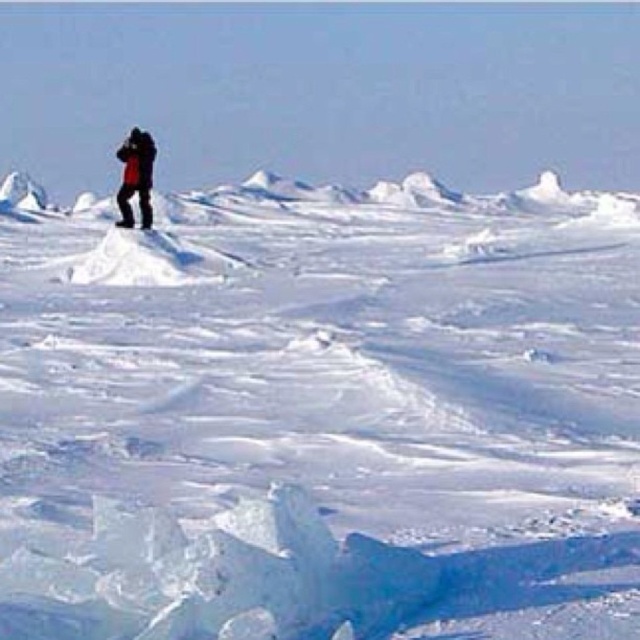
You are standing on the icy landscape and want to move towards the horizon. You see two points marked on your map, point (106, 456) and point (129, 216). Which point should you head towards if you want to reach the horizon first?

Point (106, 456) is closer to the viewer than point (129, 216), so heading towards point (106, 456) would allow you to reach the horizon first.

Consider the image. You are a photographer planning to take a photo of the icy landscape. You want to ensure that the red jacket at upper left and the white frosty snow at center are both visible in the frame. Based on their positions, which object should you position closer to the left side of the photo?

The red jacket at upper left should be positioned closer to the left side of the photo since it is already located to the left of the white frosty snow at center.

You are a photographer trying to capture the red jacket at upper left and the white frosty snow at center in the same frame. Based on their positions, which object will appear larger in the photo?

The white frosty snow at center will appear larger in the photo because it is much taller than the red jacket at upper left.